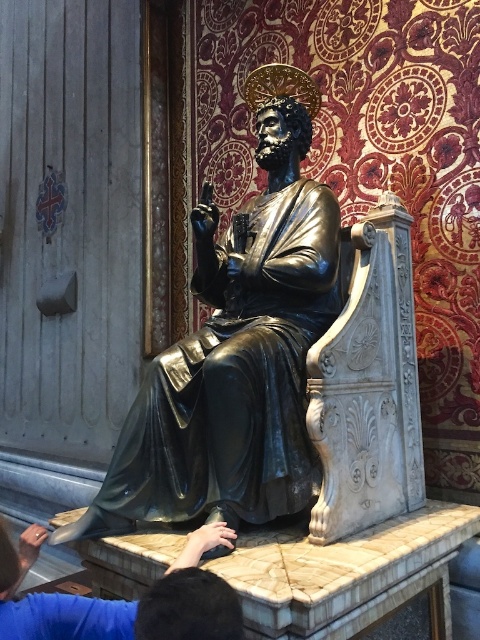
Who is lower down, shiny bronze statue at center or blue fabric hand at lower center?

blue fabric hand at lower center is below.

Image resolution: width=480 pixels, height=640 pixels. Identify the location of shiny bronze statue at center. (237, 348).

This screenshot has width=480, height=640. Identify the location of shiny bronze statue at center. (237, 348).